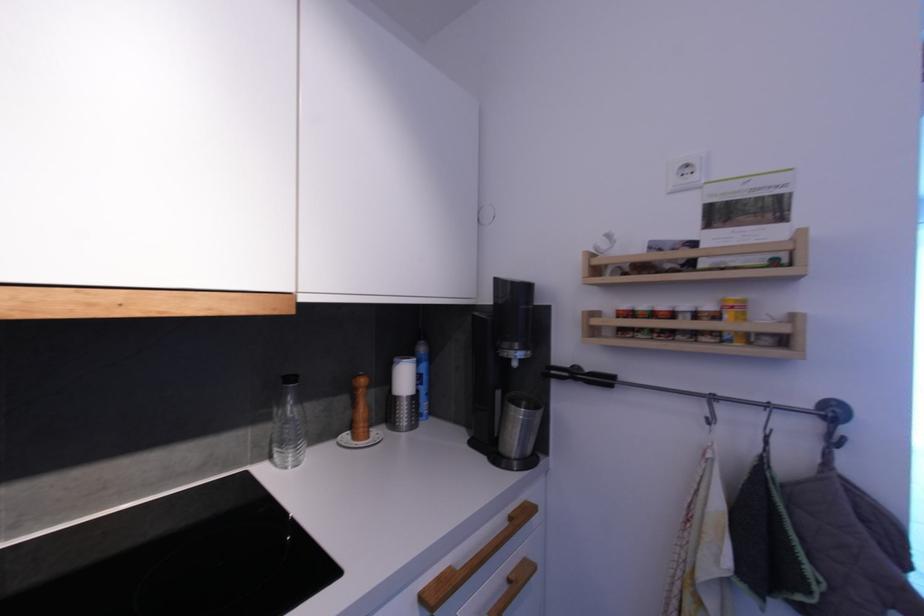
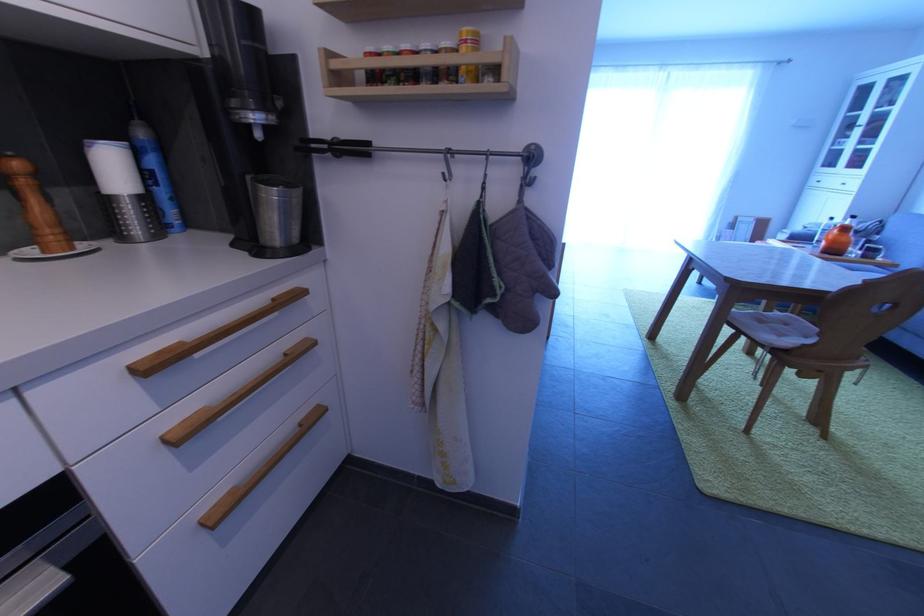
How did the camera likely rotate?

The camera rotated toward right-down.